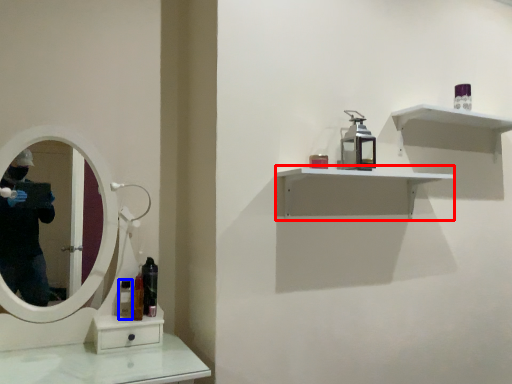
Question: Which object is further to the camera taking this photo, shelf (highlighted by a red box) or mouthwash (highlighted by a blue box)?

Choices:
 (A) shelf
 (B) mouthwash

Answer: (B)